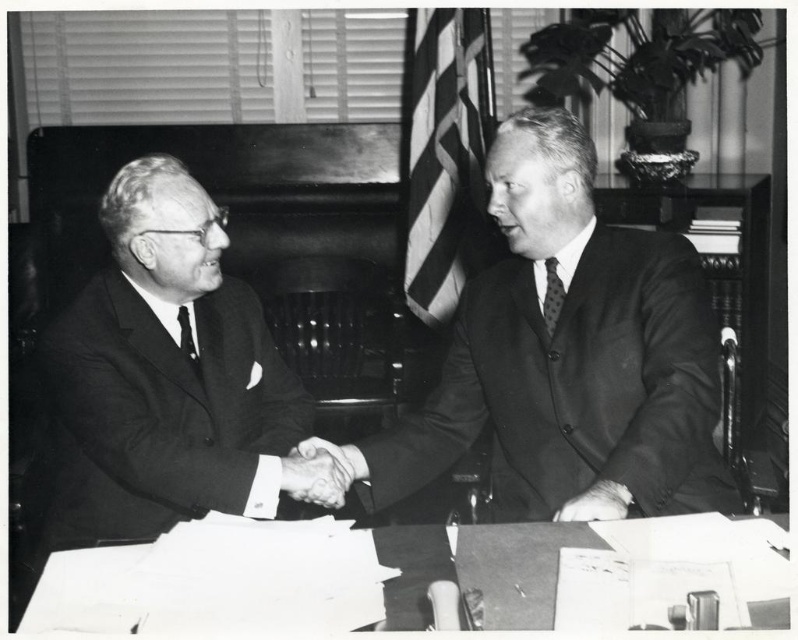
What do you see at coordinates (477, 570) in the screenshot?
I see `white paper at lower center` at bounding box center [477, 570].

This screenshot has width=798, height=640. In order to click on white paper at lower center in this screenshot , I will do `click(477, 570)`.

Does smooth black suit at center lie in front of smooth skin handshake at center?

That is True.

How distant is smooth black suit at center from smooth skin handshake at center?

smooth black suit at center is 41.29 centimeters from smooth skin handshake at center.

Between point (654, 339) and point (305, 472), which one is positioned behind?

Point (305, 472)

The width and height of the screenshot is (798, 640). In order to click on smooth black suit at center in this screenshot , I will do `click(569, 353)`.

Does point (535, 614) come in front of point (326, 449)?

Yes.

This screenshot has width=798, height=640. I want to click on white paper at lower center, so click(477, 570).